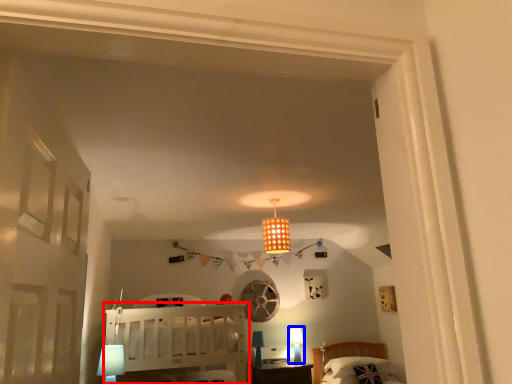
Question: Among these objects, which one is nearest to the camera, furniture (highlighted by a red box) or table lamp (highlighted by a blue box)?

Choices:
 (A) furniture
 (B) table lamp

Answer: (A)